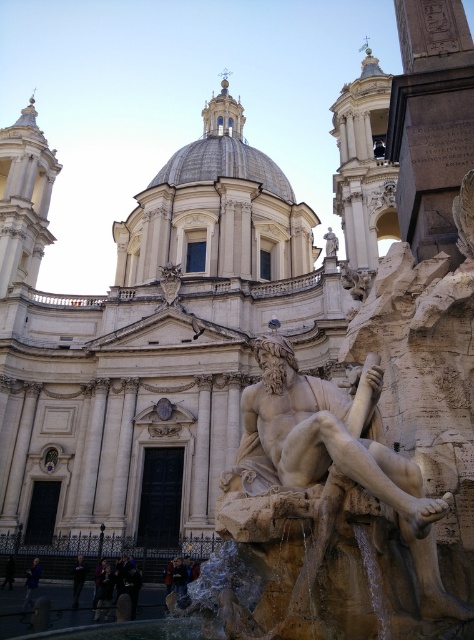
Based on the photo, which of these two, brown stone statue at center or dark gray pants at lower left, stands shorter?

dark gray pants at lower left

From the picture: Is brown stone statue at center positioned in front of dark gray pants at lower left?

Yes, brown stone statue at center is closer to the viewer.

Is point (330, 561) farther from camera compared to point (29, 582)?

No.

Where is `brown stone statue at center`? Image resolution: width=474 pixels, height=640 pixels. brown stone statue at center is located at coordinates (328, 512).